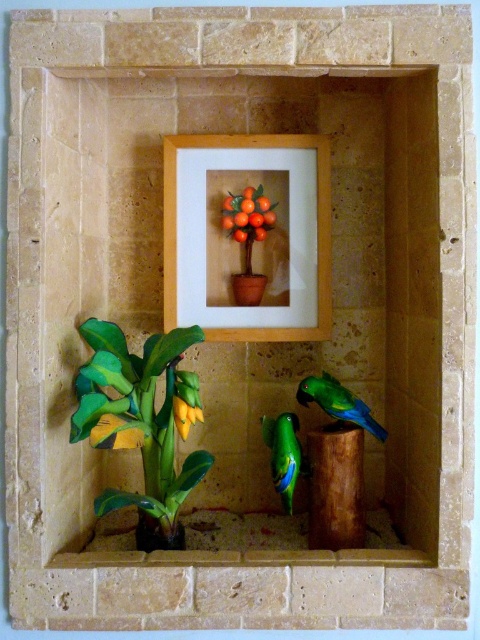
You are standing in front of the decorative niche and want to place a small vase between the green glossy parrot at center and the framed picture. Can you determine if there is enough space between them to place the vase?

The green glossy parrot at center is located at point (283, 452), but the exact position of the framed picture isn not provided in the objects description. Therefore, it is impossible to determine the distance between them and whether the vase would fit.

From the picture: You are standing in front of the decorative niche and want to place a small vase between the two artificial parrots and the yellow matte flower at lower center. Based on their positions, where should you place the vase to ensure it is equidistant from both the parrots and the flower?

The yellow matte flower at lower center is located at point [186,401]. To place the vase equidistant from the parrots and the flower, calculate the midpoint between their positions. However, since the exact coordinates of the parrots aren